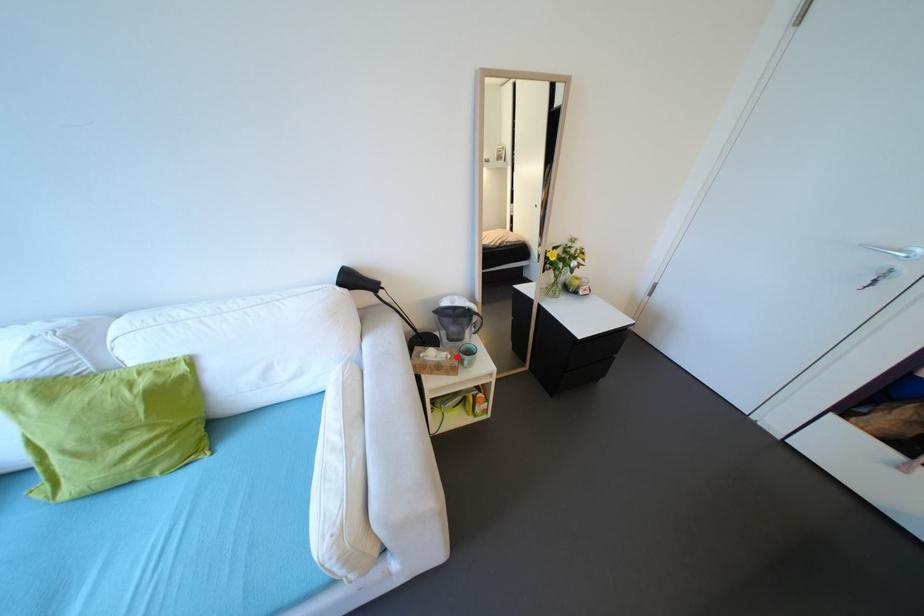
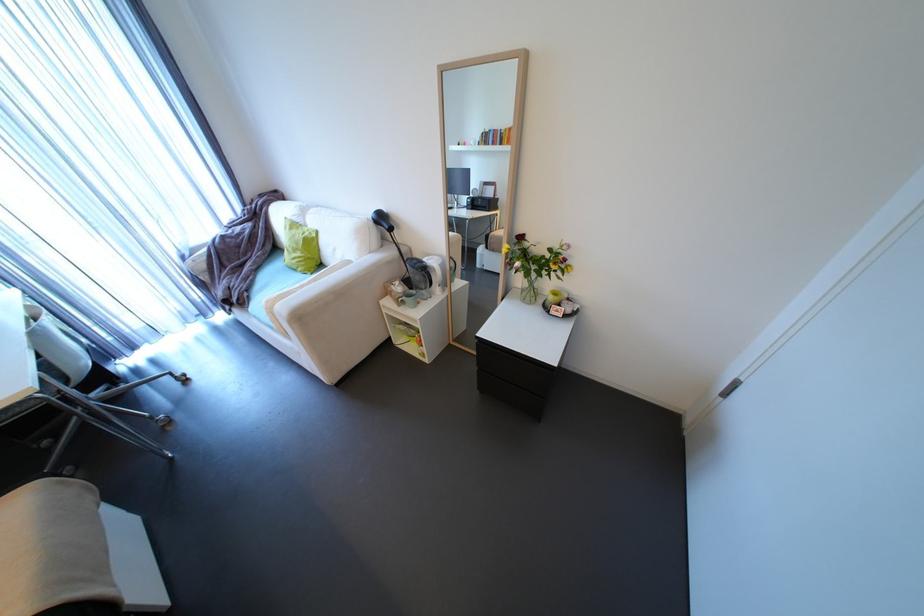
Where in the second image is the point corresponding to the highlighted location from the first image?

(407, 292)